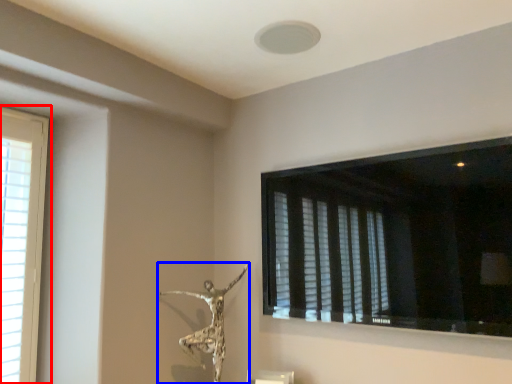
Question: Among these objects, which one is farthest to the camera, window (highlighted by a red box) or sculpture (highlighted by a blue box)?

Choices:
 (A) window
 (B) sculpture

Answer: (B)